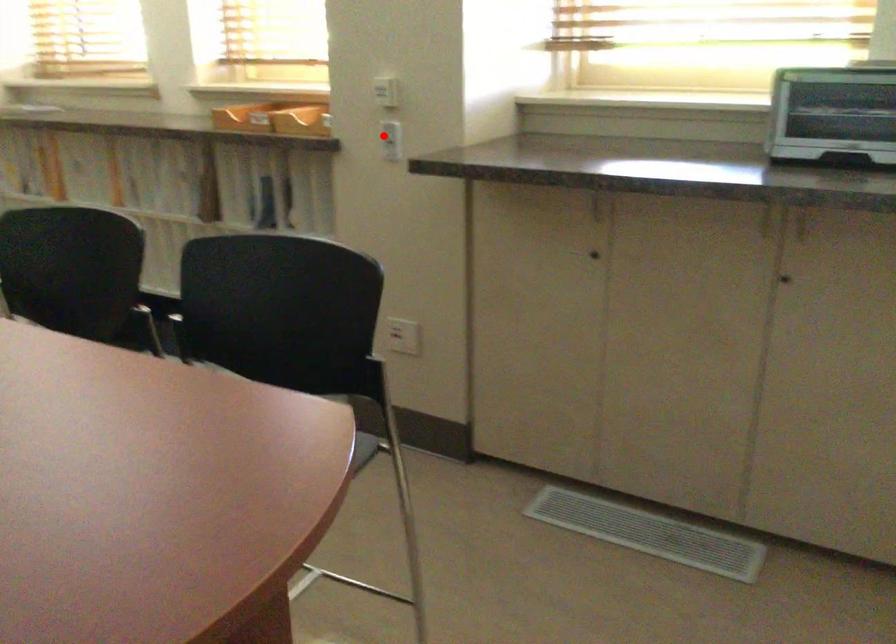
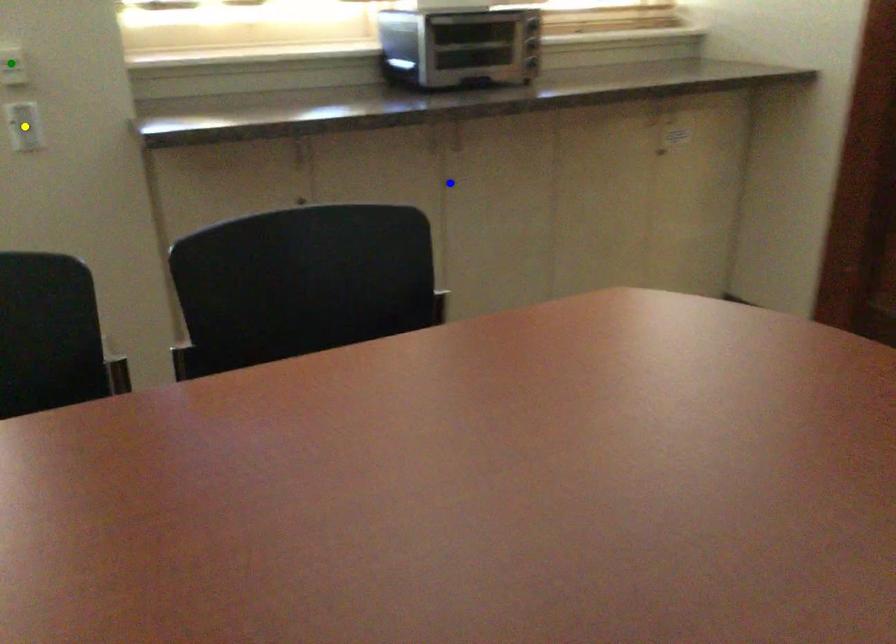
Question: I am providing you with two images of the same scene from different viewpoints. A red point is marked on the first image. You are given multiple points on the second image. Which point in image 2 is actually the same real-world point as the red point in image 1?

Choices:
 (A) yellow point
 (B) blue point
 (C) green point

Answer: (A)